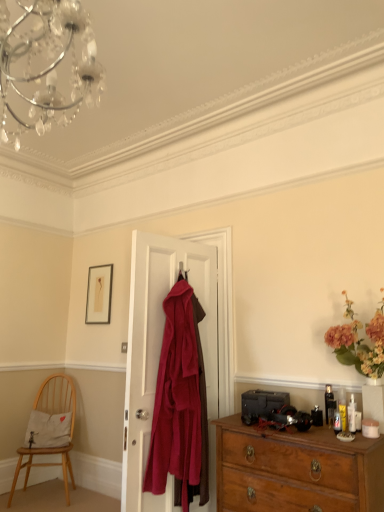
Question: Would you consider wooden chest of drawers at lower right to be distant from matte gold picture frame at upper left?

Choices:
 (A) yes
 (B) no

Answer: (A)

Question: From a real-world perspective, is wooden chest of drawers at lower right positioned under matte gold picture frame at upper left based on gravity?

Choices:
 (A) no
 (B) yes

Answer: (B)

Question: Is wooden chest of drawers at lower right shorter than matte gold picture frame at upper left?

Choices:
 (A) yes
 (B) no

Answer: (B)

Question: Is matte gold picture frame at upper left inside wooden chest of drawers at lower right?

Choices:
 (A) no
 (B) yes

Answer: (A)

Question: Is wooden chest of drawers at lower right further to the viewer compared to matte gold picture frame at upper left?

Choices:
 (A) yes
 (B) no

Answer: (B)

Question: Does wooden chest of drawers at lower right have a smaller size compared to matte gold picture frame at upper left?

Choices:
 (A) no
 (B) yes

Answer: (A)

Question: Considering the relative sizes of matte gold picture frame at upper left and velvet burgundy coat at center in the image provided, is matte gold picture frame at upper left thinner than velvet burgundy coat at center?

Choices:
 (A) yes
 (B) no

Answer: (A)

Question: Does matte gold picture frame at upper left come in front of velvet burgundy coat at center?

Choices:
 (A) yes
 (B) no

Answer: (B)

Question: Does matte gold picture frame at upper left have a larger size compared to velvet burgundy coat at center?

Choices:
 (A) no
 (B) yes

Answer: (A)

Question: Is matte gold picture frame at upper left far from velvet burgundy coat at center?

Choices:
 (A) yes
 (B) no

Answer: (A)

Question: From a real-world perspective, is matte gold picture frame at upper left on velvet burgundy coat at center?

Choices:
 (A) yes
 (B) no

Answer: (A)

Question: Is matte gold picture frame at upper left completely or partially outside of velvet burgundy coat at center?

Choices:
 (A) no
 (B) yes

Answer: (B)

Question: Is velvet burgundy coat at center outside light wood chair at lower left?

Choices:
 (A) no
 (B) yes

Answer: (B)